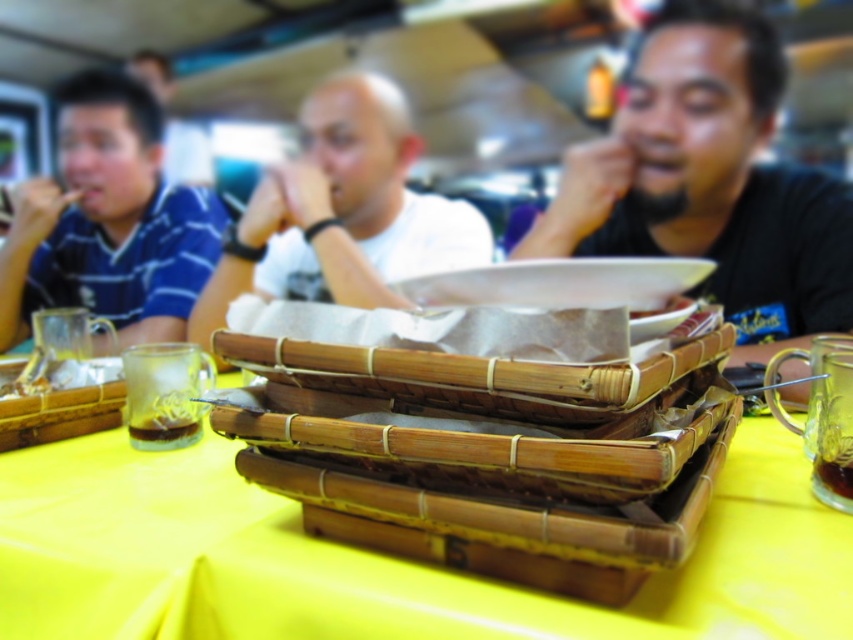
Can you confirm if blue striped shirt at left is positioned below white matte plate at center?

No, blue striped shirt at left is not below white matte plate at center.

Measure the distance from blue striped shirt at left to white matte plate at center.

blue striped shirt at left and white matte plate at center are 15.12 inches apart.

The width and height of the screenshot is (853, 640). What do you see at coordinates (108, 221) in the screenshot? I see `blue striped shirt at left` at bounding box center [108, 221].

The width and height of the screenshot is (853, 640). I want to click on blue striped shirt at left, so click(x=108, y=221).

From the picture: Does black matte shirt at upper right have a greater height compared to white matte plate at center?

No.

You are a GUI agent. You are given a task and a screenshot of the screen. Output one action in this format:
    pyautogui.click(x=<x>, y=<y>)
    Task: Click on the black matte shirt at upper right
    Image resolution: width=853 pixels, height=640 pixels.
    Given the screenshot: What is the action you would take?
    [709, 180]

Identify the location of black matte shirt at upper right. (709, 180).

Can you confirm if blue striped shirt at left is taller than translucent glass mug at lower right?

Yes.

Can you confirm if blue striped shirt at left is positioned to the right of translucent glass mug at lower right?

Incorrect, blue striped shirt at left is not on the right side of translucent glass mug at lower right.

Which is behind, point (86, 86) or point (792, 352)?

Positioned behind is point (86, 86).

Where is `blue striped shirt at left`? This screenshot has width=853, height=640. blue striped shirt at left is located at coordinates (108, 221).